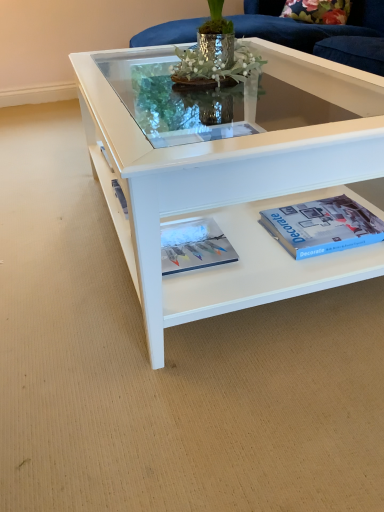
What do you see at coordinates (194, 246) in the screenshot? I see `matte white magazine at center` at bounding box center [194, 246].

Describe the element at coordinates (322, 226) in the screenshot. I see `blue matte paperback book at lower right` at that location.

Where is `matte white magazine at center`? The width and height of the screenshot is (384, 512). matte white magazine at center is located at coordinates (194, 246).

Which object is positioned more to the left, matte white magazine at center or white glossy coffee table at center?

Positioned to the left is matte white magazine at center.

Considering the relative sizes of matte white magazine at center and white glossy coffee table at center in the image provided, is matte white magazine at center shorter than white glossy coffee table at center?

Correct, matte white magazine at center is not as tall as white glossy coffee table at center.

In the image, there is a matte white magazine at center. Find the location of `coffee table above it (from the image's perspective)`. coffee table above it (from the image's perspective) is located at coordinates 234,177.

From a real-world perspective, is matte white magazine at center below white glossy coffee table at center?

Correct, in the physical world, matte white magazine at center is lower than white glossy coffee table at center.

What's the angular difference between white glossy coffee table at center and matte white magazine at center's facing directions?

white glossy coffee table at center and matte white magazine at center are facing 0.19 degrees away from each other.

Are white glossy coffee table at center and matte white magazine at center far apart?

No, there isn't a large distance between white glossy coffee table at center and matte white magazine at center.

Is white glossy coffee table at center positioned with its back to matte white magazine at center?

No.

Which is more to the left, white glossy coffee table at center or matte white magazine at center?

From the viewer's perspective, matte white magazine at center appears more on the left side.

From the image's perspective, is white glossy coffee table at center located above blue matte paperback book at lower right?

Yes, from the image's perspective, white glossy coffee table at center is above blue matte paperback book at lower right.

Based on the photo, is white glossy coffee table at center positioned with its back to blue matte paperback book at lower right?

No.

From a real-world perspective, which object rests below the other?

From a 3D spatial view, blue matte paperback book at lower right is below.

Does white glossy coffee table at center appear on the right side of blue matte paperback book at lower right?

Yes, white glossy coffee table at center is to the right of blue matte paperback book at lower right.

Are matte white magazine at center and blue matte paperback book at lower right located far from each other?

They are positioned close to each other.

Looking at this image, does matte white magazine at center have a greater width compared to blue matte paperback book at lower right?

No.

Does point (235, 252) come in front of point (379, 219)?

Yes, it is.

Considering the sizes of objects matte white magazine at center and blue matte paperback book at lower right in the image provided, who is shorter, matte white magazine at center or blue matte paperback book at lower right?

matte white magazine at center.

Is blue matte paperback book at lower right wider than white glossy coffee table at center?

Incorrect, the width of blue matte paperback book at lower right does not surpass that of white glossy coffee table at center.

Where is `paperback book located behind the white glossy coffee table at center`? The height and width of the screenshot is (512, 384). paperback book located behind the white glossy coffee table at center is located at coordinates pos(322,226).

What's the angular difference between blue matte paperback book at lower right and white glossy coffee table at center's facing directions?

There is a 0.603-degree angle between the facing directions of blue matte paperback book at lower right and white glossy coffee table at center.

Based on the photo, from the image's perspective, is blue matte paperback book at lower right under white glossy coffee table at center?

Yes.

Is blue matte paperback book at lower right located outside matte white magazine at center?

That's correct, blue matte paperback book at lower right is outside of matte white magazine at center.

Find the location of `paperback book located above the matte white magazine at center (from the image's perspective)`. paperback book located above the matte white magazine at center (from the image's perspective) is located at coordinates (322, 226).

Who is shorter, blue matte paperback book at lower right or matte white magazine at center?

matte white magazine at center.

Considering the sizes of objects blue matte paperback book at lower right and matte white magazine at center in the image provided, who is thinner, blue matte paperback book at lower right or matte white magazine at center?

matte white magazine at center is thinner.

Image resolution: width=384 pixels, height=512 pixels. In order to click on magazine behind the white glossy coffee table at center in this screenshot , I will do `click(194, 246)`.

Where is `coffee table above the matte white magazine at center (from the image's perspective)`? coffee table above the matte white magazine at center (from the image's perspective) is located at coordinates (234, 177).

From the image, which object appears to be nearer to blue matte paperback book at lower right, matte white magazine at center or white glossy coffee table at center?

white glossy coffee table at center.

From the picture: From the image, which object appears to be farther from white glossy coffee table at center, matte white magazine at center or blue matte paperback book at lower right?

Among the two, matte white magazine at center is located further to white glossy coffee table at center.

When comparing their distances from white glossy coffee table at center, does blue matte paperback book at lower right or matte white magazine at center seem further?

matte white magazine at center is further to white glossy coffee table at center.

From the image, which object appears to be nearer to matte white magazine at center, blue matte paperback book at lower right or white glossy coffee table at center?

Based on the image, white glossy coffee table at center appears to be nearer to matte white magazine at center.

Looking at the image, which one is located further to matte white magazine at center, white glossy coffee table at center or blue matte paperback book at lower right?

blue matte paperback book at lower right is further to matte white magazine at center.

From the image, which object appears to be farther from blue matte paperback book at lower right, white glossy coffee table at center or matte white magazine at center?

matte white magazine at center.

Locate an element on the screen. The height and width of the screenshot is (512, 384). paperback book between white glossy coffee table at center and matte white magazine at center from top to bottom is located at coordinates (322, 226).